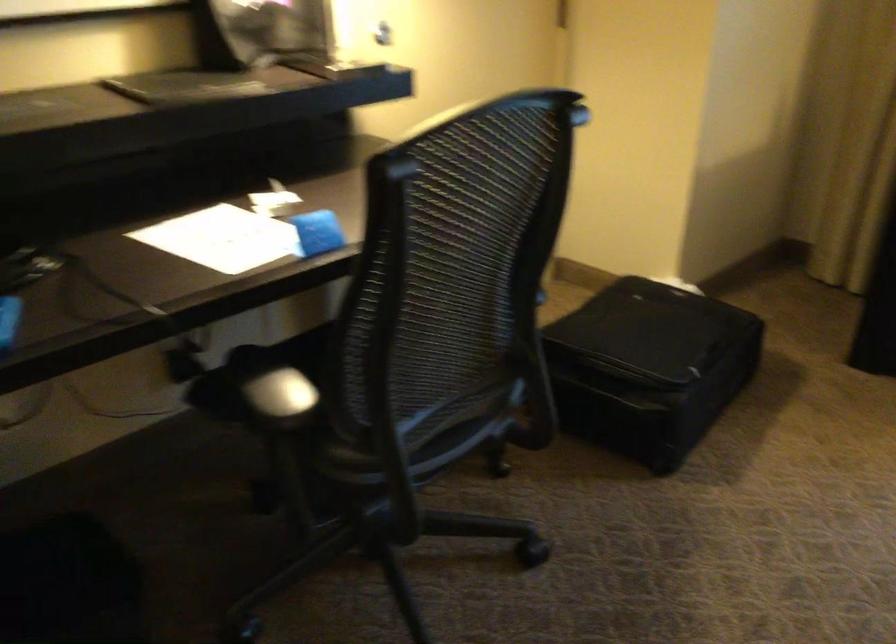
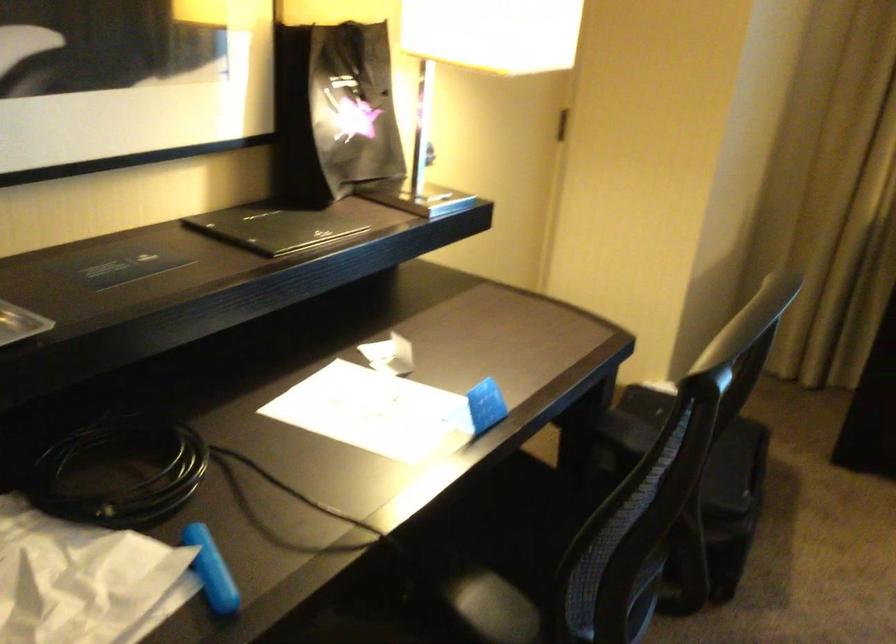
Question: Which direction would the cameraman need to move to produce the second image? Reply with the corresponding letter.

Choices:
 (A) Left
 (B) Right
 (C) Forward
 (D) Backward

Answer: (A)